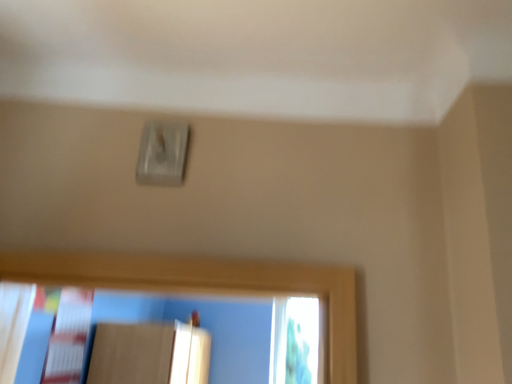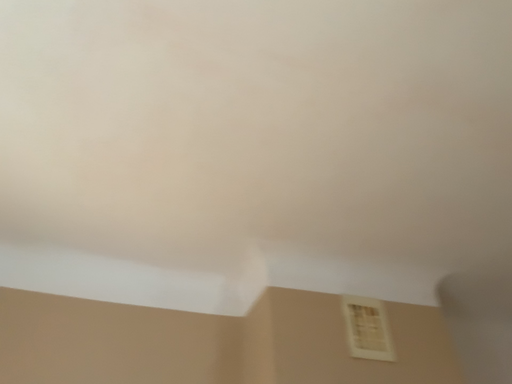
Question: Which way did the camera rotate in the video?

Choices:
 (A) rotated left
 (B) rotated right

Answer: (B)